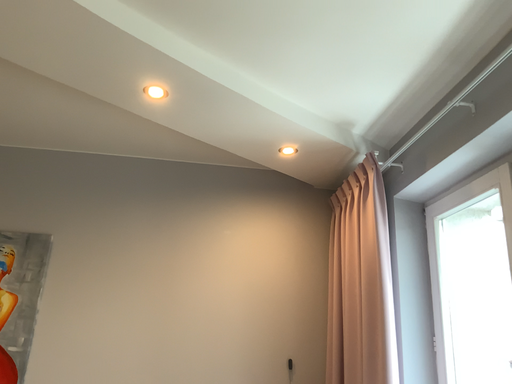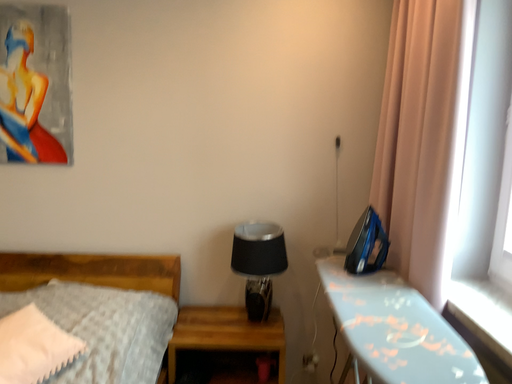
Question: How did the camera likely rotate when shooting the video?

Choices:
 (A) rotated upward
 (B) rotated downward

Answer: (B)